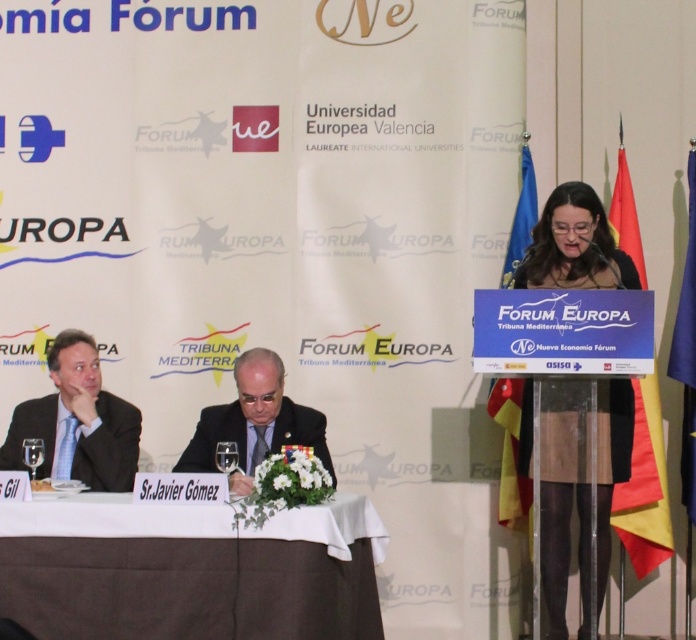
Can you confirm if white cloth at lower center is shorter than dark suit at center?

No.

Is white cloth at lower center to the right of dark suit at center from the viewer's perspective?

No, white cloth at lower center is not to the right of dark suit at center.

The image size is (696, 640). Describe the element at coordinates (189, 570) in the screenshot. I see `white cloth at lower center` at that location.

This screenshot has height=640, width=696. In order to click on white cloth at lower center in this screenshot , I will do `click(189, 570)`.

Who is higher up, white cloth at lower center or red fabric flag at right?

Positioned higher is red fabric flag at right.

Is point (118, 614) more distant than point (654, 493)?

No, (118, 614) is in front of (654, 493).

Locate an element on the screen. The height and width of the screenshot is (640, 696). white cloth at lower center is located at coordinates (189, 570).

Does white cloth at lower center have a greater height compared to matte black suit at left?

Incorrect, white cloth at lower center's height is not larger of matte black suit at left's.

The image size is (696, 640). Describe the element at coordinates (189, 570) in the screenshot. I see `white cloth at lower center` at that location.

Where is `white cloth at lower center`? This screenshot has height=640, width=696. white cloth at lower center is located at coordinates (189, 570).